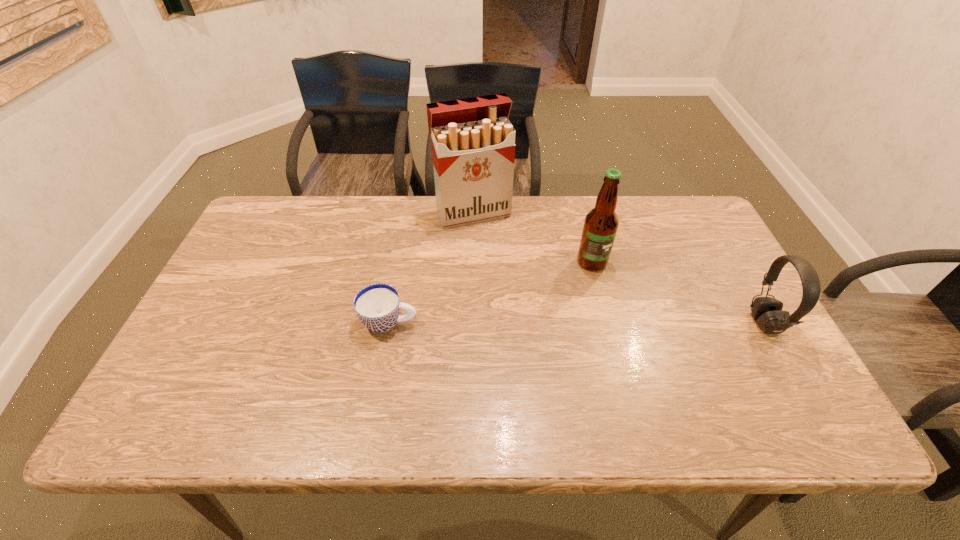
At what (x,y) coordinates should I click in order to perform the action: click on the shortest object. Please return your answer as a coordinate pair (x, y). The width and height of the screenshot is (960, 540). Looking at the image, I should click on (377, 306).

Find the location of a particular element. the leftmost object is located at coordinates (377, 306).

Identify the location of headset. (767, 312).

Locate an element on the screen. the third tallest object is located at coordinates (767, 312).

You are a GUI agent. You are given a task and a screenshot of the screen. Output one action in this format:
    pyautogui.click(x=<x>, y=<y>)
    Task: Click on the third object from left to right
    This screenshot has height=540, width=960.
    Given the screenshot: What is the action you would take?
    pyautogui.click(x=601, y=223)

Locate an element on the screen. The width and height of the screenshot is (960, 540). beer bottle is located at coordinates (601, 223).

You are a GUI agent. You are given a task and a screenshot of the screen. Output one action in this format:
    pyautogui.click(x=<x>, y=<y>)
    Task: Click on the tallest object
    
    Given the screenshot: What is the action you would take?
    pyautogui.click(x=473, y=142)

I want to click on the third object from right to left, so click(473, 142).

Where is `free spot located 0.060m on the side of the cup with the handle`? The height and width of the screenshot is (540, 960). free spot located 0.060m on the side of the cup with the handle is located at coordinates (442, 322).

In order to click on blank space located on the front-facing side of the headset in this screenshot , I will do `click(673, 323)`.